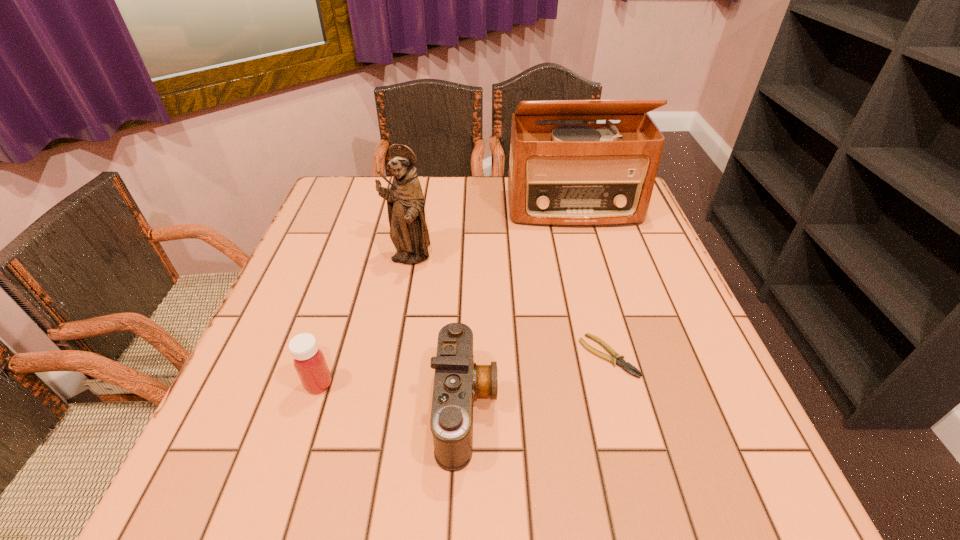
You are a GUI agent. You are given a task and a screenshot of the screen. Output one action in this format:
    pyautogui.click(x=<x>, y=<y>)
    Task: Click on the vacant space at the right edge of the desktop
    The image size is (960, 540).
    Given the screenshot: What is the action you would take?
    pyautogui.click(x=632, y=294)

You are a GUI agent. You are given a task and a screenshot of the screen. Output one action in this format:
    pyautogui.click(x=<x>, y=<y>)
    Task: Click on the vacant position at the near right corner of the desktop
    Image resolution: width=960 pixels, height=540 pixels.
    Given the screenshot: What is the action you would take?
    pyautogui.click(x=705, y=458)

This screenshot has width=960, height=540. In order to click on free spot between the fourth nearest object and the pliers in this screenshot , I will do `click(509, 308)`.

Where is `free space that is in between the pliers and the fourth object from right to left`? Image resolution: width=960 pixels, height=540 pixels. free space that is in between the pliers and the fourth object from right to left is located at coordinates (509, 308).

Locate an element on the screen. The image size is (960, 540). free space that is in between the figurine and the medicine is located at coordinates (364, 322).

Where is `unoccupied area between the camera and the radio receiver`? unoccupied area between the camera and the radio receiver is located at coordinates (519, 308).

Image resolution: width=960 pixels, height=540 pixels. Find the location of `free space between the farthest object and the figurine`. free space between the farthest object and the figurine is located at coordinates (492, 234).

You are a GUI agent. You are given a task and a screenshot of the screen. Output one action in this format:
    pyautogui.click(x=<x>, y=<y>)
    Task: Click on the empty location between the second object from left to right and the leftmost object
    The width and height of the screenshot is (960, 540).
    Given the screenshot: What is the action you would take?
    pyautogui.click(x=364, y=322)

The height and width of the screenshot is (540, 960). I want to click on empty space between the camera and the shortest object, so click(x=537, y=382).

The image size is (960, 540). Identify the location of empty space that is in between the third object from left to right and the pliers. (537, 382).